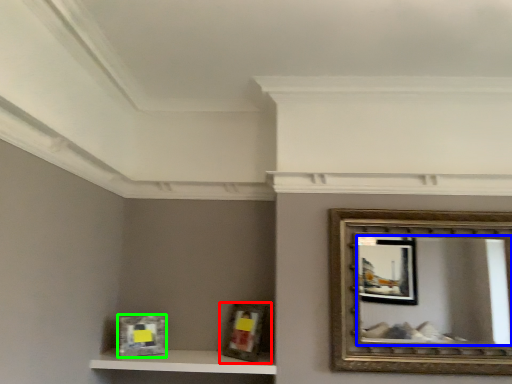
Question: Which object is the farthest from picture frame (highlighted by a red box)? Choose among these: mirror (highlighted by a blue box) or picture frame (highlighted by a green box).

Choices:
 (A) mirror
 (B) picture frame

Answer: (A)